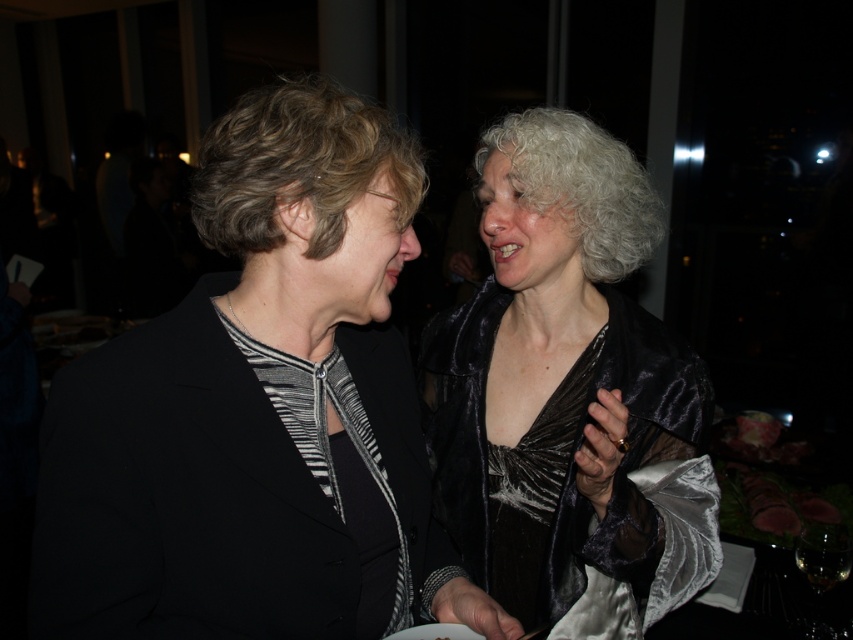
Based on the scene description, where is the matte black blazer at left located in terms of its 2D coordinates?

The matte black blazer at left is located at the 2D coordinates point (259,412).

You are a photographer at a social event and need to capture a photo of both the matte black blazer at left and the satin black dress at right. The venue has a limited space between them. Can you fit both subjects into the frame without moving either of them?

The matte black blazer at left is positioned on the left side of the satin black dress at right, so yes, they are already aligned side by side and can be captured in the same frame without needing to move either subject.

You are a photographer at the event and need to adjust the lighting to ensure both the matte black blazer at left and the satin black dress at right are equally visible. Given their size difference, which clothing item might require more strategic lighting to avoid appearing too small or too large in the photo?

The matte black blazer at left has a smaller size compared to the satin black dress at right. To balance their visibility, the smaller matte black blazer at left may need more focused lighting to prevent it from appearing too small in the photo, while the larger satin black dress at right might require softer lighting to avoid overwhelming the composition.